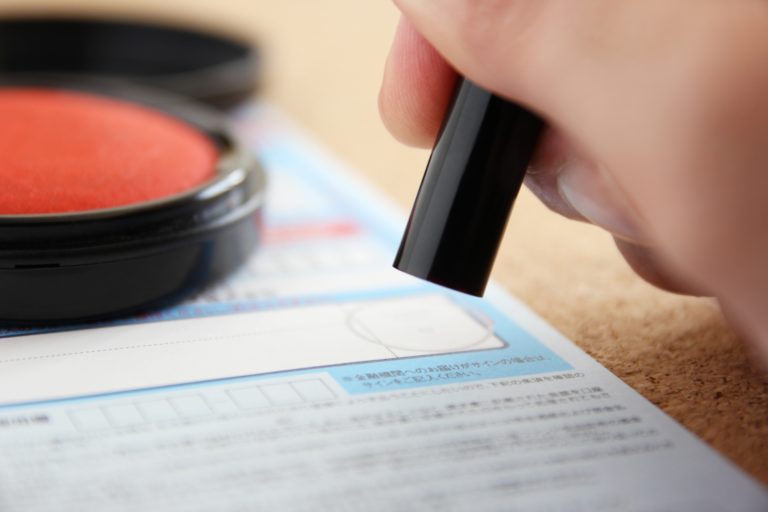
At what (x,y) coordinates should I click in order to perform the action: click on wet sponge. Please return your answer as a coordinate pair (x, y). Looking at the image, I should click on (101, 146).